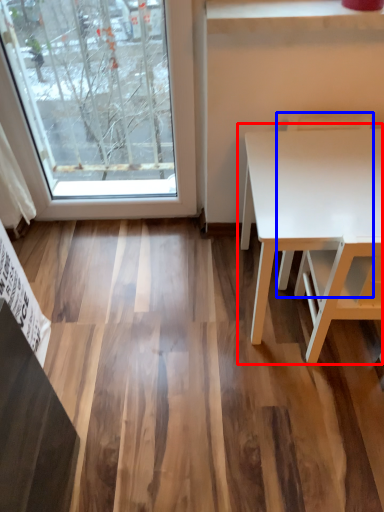
Question: Among these objects, which one is farthest to the camera, table (highlighted by a red box) or chair (highlighted by a blue box)?

Choices:
 (A) table
 (B) chair

Answer: (B)